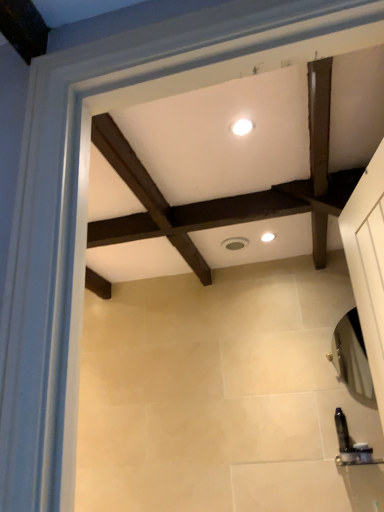
Question: From a real-world perspective, is white glossy light fixture at upper center, the 2th lighting from the right, located higher than white glossy light fixture at center, the second lighting viewed from the front?

Choices:
 (A) no
 (B) yes

Answer: (B)

Question: Is white glossy light fixture at upper center, positioned as the 1th lighting in left-to-right order, directly adjacent to white glossy light fixture at center, the second lighting when ordered from top to bottom?

Choices:
 (A) yes
 (B) no

Answer: (B)

Question: Can you confirm if white glossy light fixture at upper center, acting as the first lighting starting from the front, is taller than white glossy light fixture at center, which is counted as the 1th lighting, starting from the back?

Choices:
 (A) no
 (B) yes

Answer: (A)

Question: Can white glossy light fixture at center, the second lighting when ordered from top to bottom, be found inside white glossy light fixture at upper center, the second lighting in the bottom-to-top sequence?

Choices:
 (A) no
 (B) yes

Answer: (A)

Question: Could you tell me if white glossy light fixture at upper center, placed as the 1th lighting when sorted from top to bottom, is facing white glossy light fixture at center, the second lighting viewed from the front?

Choices:
 (A) no
 (B) yes

Answer: (A)

Question: Does point (233, 124) appear closer or farther from the camera than point (271, 239)?

Choices:
 (A) farther
 (B) closer

Answer: (B)

Question: From their relative heights in the image, would you say white glossy light fixture at upper center, placed as the 1th lighting when sorted from top to bottom, is taller or shorter than white glossy light fixture at center, which is counted as the 1th lighting, starting from the back?

Choices:
 (A) short
 (B) tall

Answer: (A)

Question: Which is correct: white glossy light fixture at upper center, acting as the first lighting starting from the front, is inside white glossy light fixture at center, which is the 1th lighting from right to left, or outside of it?

Choices:
 (A) inside
 (B) outside

Answer: (B)

Question: From the image's perspective, relative to white glossy light fixture at center, the second lighting viewed from the front, is white glossy light fixture at upper center, the second lighting in the bottom-to-top sequence, above or below?

Choices:
 (A) below
 (B) above

Answer: (B)

Question: From their relative heights in the image, would you say white glossy light fixture at upper center, placed as the 1th lighting when sorted from top to bottom, is taller or shorter than translucent plastic soap dispenser at lower right, which is the first toiletry from right to left?

Choices:
 (A) tall
 (B) short

Answer: (B)

Question: From a real-world perspective, relative to translucent plastic soap dispenser at lower right, which is the first toiletry from right to left, is white glossy light fixture at upper center, the second lighting in the bottom-to-top sequence, vertically above or below?

Choices:
 (A) below
 (B) above

Answer: (B)

Question: Is white glossy light fixture at upper center, the second lighting in the back-to-front sequence, spatially inside translucent plastic soap dispenser at lower right, which is the first toiletry from right to left, or outside of it?

Choices:
 (A) inside
 (B) outside

Answer: (B)

Question: From the image's perspective, is white glossy light fixture at upper center, positioned as the 1th lighting in left-to-right order, above or below translucent plastic soap dispenser at lower right, which is the first toiletry from right to left?

Choices:
 (A) below
 (B) above

Answer: (B)

Question: In terms of height, does black plastic toiletry at lower right, acting as the 2th toiletry starting from the right, look taller or shorter compared to white glossy light fixture at upper center, the second lighting in the back-to-front sequence?

Choices:
 (A) tall
 (B) short

Answer: (A)

Question: Is black plastic toiletry at lower right, acting as the 2th toiletry starting from the right, inside the boundaries of white glossy light fixture at upper center, positioned as the 1th lighting in left-to-right order, or outside?

Choices:
 (A) inside
 (B) outside

Answer: (B)